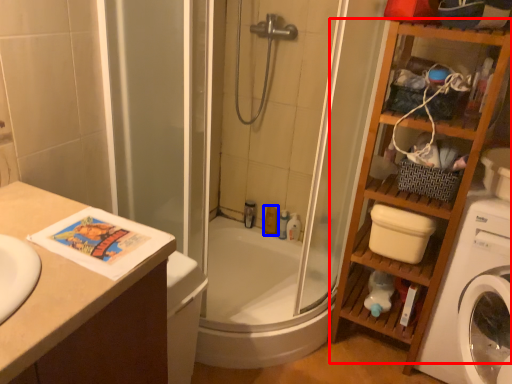
Question: Which of the following is the closest to the observer, cabinet (highlighted by a red box) or toiletry (highlighted by a blue box)?

Choices:
 (A) cabinet
 (B) toiletry

Answer: (A)